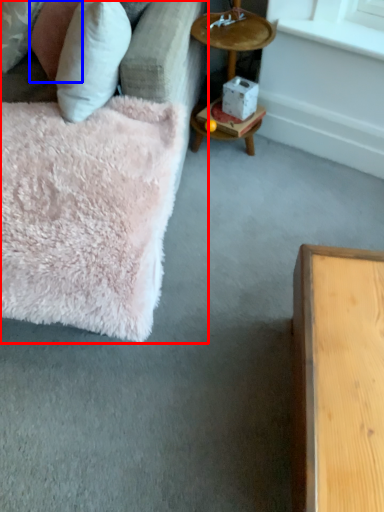
Question: Among these objects, which one is farthest to the camera, studio couch (highlighted by a red box) or pillow (highlighted by a blue box)?

Choices:
 (A) studio couch
 (B) pillow

Answer: (B)